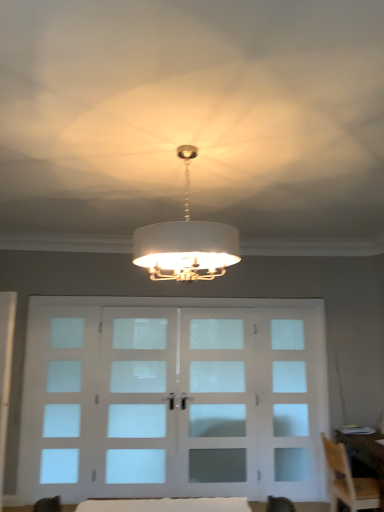
What is the approximate height of frosted glass window at left?

The height of frosted glass window at left is 1.98 meters.

Locate an element on the screen. The height and width of the screenshot is (512, 384). clear glass door at center, arranged as the 1th screen door when viewed from the left is located at coordinates (137, 393).

The height and width of the screenshot is (512, 384). Describe the element at coordinates (348, 481) in the screenshot. I see `wooden chair at lower right` at that location.

Identify the location of clear glass door at center, acting as the 2th screen door starting from the left. This screenshot has height=512, width=384. (216, 404).

What are the coordinates of `white fabric lampshade at center` in the screenshot? It's located at (186, 242).

Who is taller, frosted glass window at left or white fabric table at lower center?

frosted glass window at left.

Could you tell me if frosted glass window at left is facing white fabric table at lower center?

No, frosted glass window at left is not facing towards white fabric table at lower center.

Would you say frosted glass window at left is inside or outside white fabric table at lower center?

The correct answer is: outside.

From the image's perspective, who appears lower, frosted glass window at left or white fabric table at lower center?

frosted glass window at left.

Which object is thinner, clear glass door at center, acting as the 2th screen door starting from the left, or white fabric table at lower center?

clear glass door at center, acting as the 2th screen door starting from the left.

How far apart are clear glass door at center, acting as the 2th screen door starting from the left, and white fabric table at lower center?

clear glass door at center, acting as the 2th screen door starting from the left, is 5.68 feet from white fabric table at lower center.

Does clear glass door at center, acting as the 2th screen door starting from the left, have a larger size compared to white fabric table at lower center?

Yes.

From the image's perspective, is clear glass door at center, acting as the 2th screen door starting from the left, located above or below white fabric table at lower center?

clear glass door at center, acting as the 2th screen door starting from the left, is below white fabric table at lower center.

Is white fabric lampshade at center placed right next to white fabric table at lower center?

There is a gap between white fabric lampshade at center and white fabric table at lower center.

The image size is (384, 512). Identify the location of furniture located behind the white fabric lampshade at center. (167, 505).

Which point is more forward, [179,277] or [102,507]?

Point [179,277]

Does white fabric lampshade at center have a smaller size compared to white fabric table at lower center?

No, white fabric lampshade at center is not smaller than white fabric table at lower center.

Looking at this image, from a real-world perspective, is clear glass door at center, arranged as the 1th screen door when viewed from the left, positioned over clear glass door at center, acting as the 2th screen door starting from the left, based on gravity?

No, from a real-world perspective, clear glass door at center, arranged as the 1th screen door when viewed from the left, is not on top of clear glass door at center, acting as the 2th screen door starting from the left.

At what (x,y) coordinates should I click in order to perform the action: click on screen door below the clear glass door at center, acting as the 2th screen door starting from the left (from a real-world perspective). Please return your answer as a coordinate pair (x, y). Looking at the image, I should click on (137, 393).

Looking at the image, does clear glass door at center, arranged as the 1th screen door when viewed from the left, seem bigger or smaller compared to clear glass door at center, acting as the 2th screen door starting from the left?

In the image, clear glass door at center, arranged as the 1th screen door when viewed from the left, appears to be larger than clear glass door at center, acting as the 2th screen door starting from the left.

Does point (153, 328) lie in front of point (225, 396)?

No.

From the image's perspective, who appears lower, white fabric table at lower center or frosted glass window at left?

frosted glass window at left is shown below in the image.

Considering the relative sizes of white fabric table at lower center and frosted glass window at left in the image provided, is white fabric table at lower center smaller than frosted glass window at left?

Yes, white fabric table at lower center is smaller than frosted glass window at left.

This screenshot has width=384, height=512. In order to click on window behind the white fabric table at lower center in this screenshot , I will do `click(62, 419)`.

Can you confirm if white fabric table at lower center is positioned to the right of frosted glass window at left?

Correct, you'll find white fabric table at lower center to the right of frosted glass window at left.

Which is closer, (x=226, y=504) or (x=183, y=311)?

Point (x=226, y=504) is positioned closer to the camera compared to point (x=183, y=311).

Is white fabric table at lower center bigger or smaller than clear glass door at center, acting as the 2th screen door starting from the left?

Clearly, white fabric table at lower center is smaller in size than clear glass door at center, acting as the 2th screen door starting from the left.

Are white fabric table at lower center and clear glass door at center, acting as the 2th screen door starting from the left, making contact?

No, white fabric table at lower center is not with clear glass door at center, acting as the 2th screen door starting from the left.

Considering the relative sizes of white fabric table at lower center and clear glass door at center, acting as the 2th screen door starting from the left, in the image provided, is white fabric table at lower center wider than clear glass door at center, acting as the 2th screen door starting from the left,?

Yes, white fabric table at lower center is wider than clear glass door at center, acting as the 2th screen door starting from the left.

Between clear glass door at center, acting as the 2th screen door starting from the right, and white fabric lampshade at center, which one has smaller size?

With smaller size is clear glass door at center, acting as the 2th screen door starting from the right.

Considering the points (159, 435) and (201, 252), which point is in front, point (159, 435) or point (201, 252)?

The point (201, 252) is more forward.

Is clear glass door at center, acting as the 2th screen door starting from the right, positioned far away from white fabric lampshade at center?

Yes, clear glass door at center, acting as the 2th screen door starting from the right, and white fabric lampshade at center are located far from each other.

In the scene shown: From a real-world perspective, is clear glass door at center, acting as the 2th screen door starting from the right, above or below white fabric lampshade at center?

From a real-world perspective, clear glass door at center, acting as the 2th screen door starting from the right, is physically below white fabric lampshade at center.

The height and width of the screenshot is (512, 384). I want to click on window below the white fabric table at lower center (from the image's perspective), so click(x=62, y=419).

The width and height of the screenshot is (384, 512). I want to click on furniture lying on the left of clear glass door at center, placed as the first screen door when sorted from right to left, so click(x=167, y=505).

Which object lies further to the anchor point white fabric table at lower center, clear glass door at center, arranged as the 1th screen door when viewed from the left, or frosted glass window at left?

Based on the image, frosted glass window at left appears to be further to white fabric table at lower center.

Which object lies nearer to the anchor point clear glass door at center, acting as the 2th screen door starting from the left, clear glass door at center, arranged as the 1th screen door when viewed from the left, or white fabric table at lower center?

Among the two, clear glass door at center, arranged as the 1th screen door when viewed from the left, is located nearer to clear glass door at center, acting as the 2th screen door starting from the left.

Which object lies further to the anchor point white fabric lampshade at center, frosted glass window at left or clear glass door at center, placed as the first screen door when sorted from right to left?

frosted glass window at left is further to white fabric lampshade at center.

Which object lies nearer to the anchor point white fabric table at lower center, clear glass door at center, placed as the first screen door when sorted from right to left, or frosted glass window at left?

clear glass door at center, placed as the first screen door when sorted from right to left, is positioned closer to the anchor white fabric table at lower center.

Which object lies further to the anchor point white fabric lampshade at center, wooden chair at lower right or frosted glass window at left?

frosted glass window at left is further to white fabric lampshade at center.

From the picture: Considering their positions, is frosted glass window at left positioned further to clear glass door at center, acting as the 2th screen door starting from the left, than white fabric table at lower center?

Based on the image, white fabric table at lower center appears to be further to clear glass door at center, acting as the 2th screen door starting from the left.

Which object lies nearer to the anchor point wooden chair at lower right, clear glass door at center, acting as the 2th screen door starting from the left, or frosted glass window at left?

Based on the image, clear glass door at center, acting as the 2th screen door starting from the left, appears to be nearer to wooden chair at lower right.

When comparing their distances from wooden chair at lower right, does clear glass door at center, acting as the 2th screen door starting from the right, or white fabric lampshade at center seem further?

white fabric lampshade at center is further to wooden chair at lower right.

The image size is (384, 512). In order to click on screen door located between white fabric lampshade at center and frosted glass window at left in the depth direction in this screenshot , I will do `click(137, 393)`.

Find the location of a particular element. This screenshot has width=384, height=512. screen door positioned between white fabric table at lower center and frosted glass window at left from near to far is located at coordinates (137, 393).

Find the location of a particular element. Image resolution: width=384 pixels, height=512 pixels. furniture positioned between white fabric lampshade at center and clear glass door at center, acting as the 2th screen door starting from the right, from near to far is located at coordinates (167, 505).

I want to click on window between white fabric table at lower center and clear glass door at center, acting as the 2th screen door starting from the left, along the z-axis, so click(x=62, y=419).